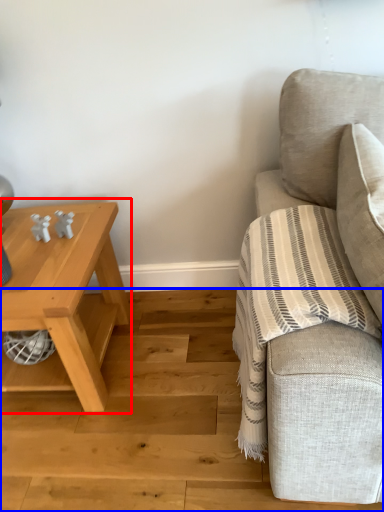
Question: Which object is further to the camera taking this photo, table (highlighted by a red box) or stair (highlighted by a blue box)?

Choices:
 (A) table
 (B) stair

Answer: (A)